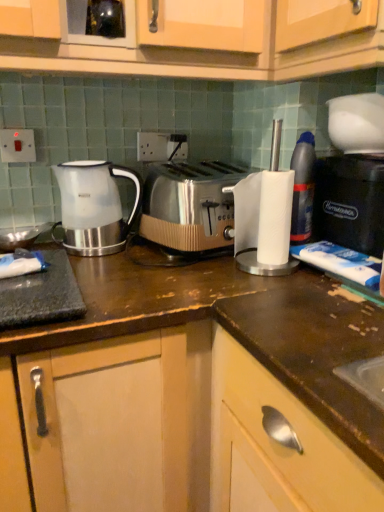
Question: Is black plastic coffee machine at right bigger than satin silver toaster at center?

Choices:
 (A) yes
 (B) no

Answer: (B)

Question: Is black plastic coffee machine at right in front of satin silver toaster at center?

Choices:
 (A) no
 (B) yes

Answer: (B)

Question: Does black plastic coffee machine at right have a greater height compared to satin silver toaster at center?

Choices:
 (A) no
 (B) yes

Answer: (B)

Question: Can we say black plastic coffee machine at right lies outside satin silver toaster at center?

Choices:
 (A) yes
 (B) no

Answer: (A)

Question: From a real-world perspective, is black plastic coffee machine at right physically above satin silver toaster at center?

Choices:
 (A) no
 (B) yes

Answer: (B)

Question: Can you confirm if black plastic coffee machine at right is smaller than satin silver toaster at center?

Choices:
 (A) yes
 (B) no

Answer: (A)

Question: Does white glossy kettle at left lie in front of black plastic coffee machine at right?

Choices:
 (A) no
 (B) yes

Answer: (A)

Question: Considering the relative sizes of white glossy kettle at left and black plastic coffee machine at right in the image provided, is white glossy kettle at left bigger than black plastic coffee machine at right?

Choices:
 (A) no
 (B) yes

Answer: (A)

Question: Does white glossy kettle at left appear on the left side of black plastic coffee machine at right?

Choices:
 (A) yes
 (B) no

Answer: (A)

Question: Can you confirm if white glossy kettle at left is positioned to the right of black plastic coffee machine at right?

Choices:
 (A) no
 (B) yes

Answer: (A)

Question: Is white glossy kettle at left shorter than black plastic coffee machine at right?

Choices:
 (A) no
 (B) yes

Answer: (A)

Question: Is white glossy kettle at left oriented away from black plastic coffee machine at right?

Choices:
 (A) no
 (B) yes

Answer: (A)

Question: Considering the relative positions of satin silver toaster at center and translucent plastic bottle at right in the image provided, is satin silver toaster at center to the left of translucent plastic bottle at right from the viewer's perspective?

Choices:
 (A) no
 (B) yes

Answer: (B)